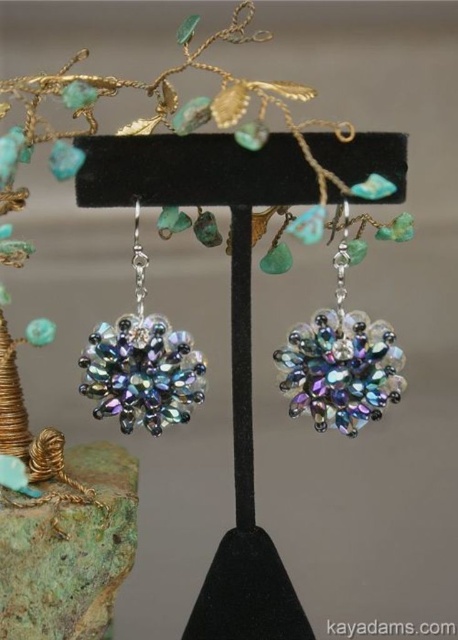
You are an appraiser examining the jewelry display. You notice the iridescent glass earrings at center and the iridescent glass flower at center. Which one is positioned higher in the image?

The iridescent glass earrings at center are positioned higher than the iridescent glass flower at center.

You are an appraiser examining a jewelry display. You see the point at coordinates (x=342, y=356). What object is located at that point?

The point at coordinates (x=342, y=356) corresponds to the iridescent glass earrings at center.